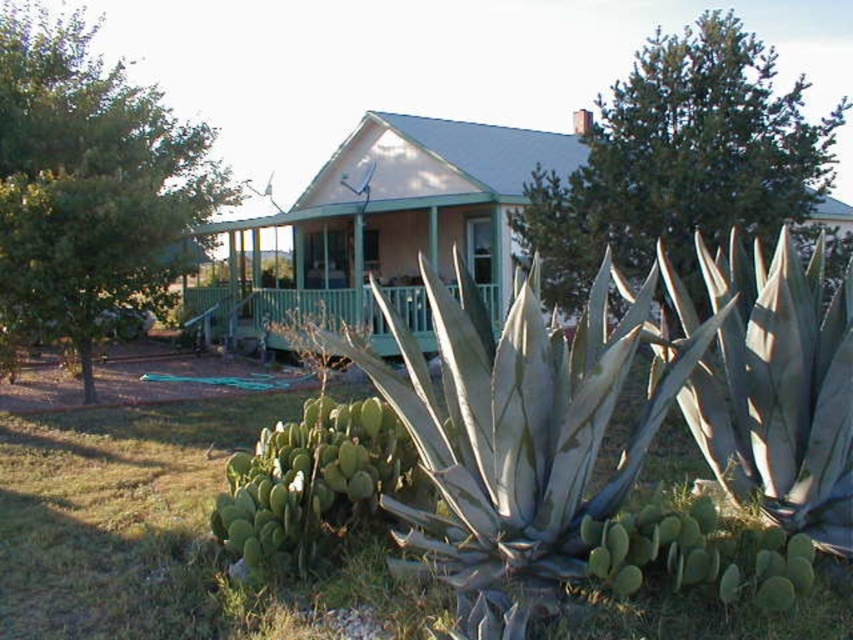
Can you confirm if green leafy tree at left is positioned to the right of green leafy tree at upper center?

In fact, green leafy tree at left is to the left of green leafy tree at upper center.

Is green leafy tree at left further to the viewer compared to green leafy tree at upper center?

Yes, it is behind green leafy tree at upper center.

Who is more distant from viewer, (103, 244) or (798, 84)?

Positioned behind is point (798, 84).

At what (x,y) coordinates should I click in order to perform the action: click on green leafy tree at left. Please return your answer as a coordinate pair (x, y). Looking at the image, I should click on (90, 182).

Who is more distant from viewer, (537, 172) or (279, 349)?

Positioned behind is point (279, 349).

Who is lower down, green leafy tree at upper center or green wood porch at center?

Positioned lower is green wood porch at center.

The height and width of the screenshot is (640, 853). What are the coordinates of `green leafy tree at upper center` in the screenshot? It's located at (680, 160).

Is green leafy tree at left smaller than green wood porch at center?

Actually, green leafy tree at left might be larger than green wood porch at center.

Is point (68, 60) positioned after point (206, 288)?

No, (68, 60) is in front of (206, 288).

This screenshot has height=640, width=853. In order to click on green leafy tree at left in this screenshot , I will do `click(90, 182)`.